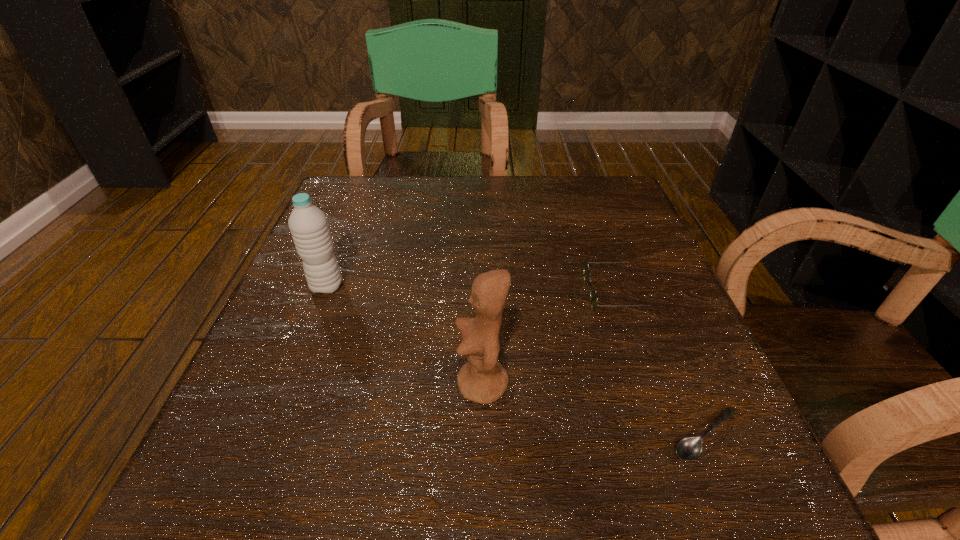
Identify the location of free location located 0.060m on the front-facing side of the sunglasses. (556, 293).

In order to click on free location located 0.120m on the back of the soupspoon in this screenshot , I will do `click(668, 343)`.

Locate an element on the screen. object at the near edge is located at coordinates (690, 448).

Where is `object that is at the left edge`? object that is at the left edge is located at coordinates (308, 225).

The width and height of the screenshot is (960, 540). I want to click on sunglasses located in the right edge section of the desktop, so click(593, 294).

Find the location of `soupspoon situated at the right edge`. soupspoon situated at the right edge is located at coordinates (690, 448).

Where is `object situated at the near right corner`? object situated at the near right corner is located at coordinates (690, 448).

Locate an element on the screen. The height and width of the screenshot is (540, 960). free region at the far edge of the desktop is located at coordinates (557, 221).

Find the location of a particular element. vacant space at the near edge of the desktop is located at coordinates (568, 490).

This screenshot has height=540, width=960. What are the coordinates of `vacant space at the left edge` in the screenshot? It's located at (299, 322).